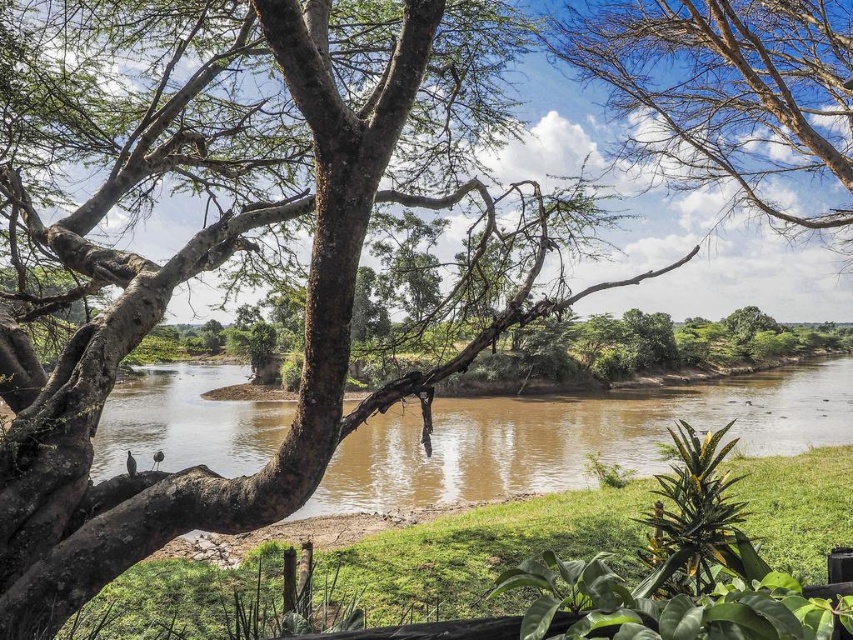
Question: Which point appears farthest from the camera in this image?

Choices:
 (A) (576, 403)
 (B) (614, 52)

Answer: (A)

Question: Which of the following is the farthest from the observer?

Choices:
 (A) (515, 458)
 (B) (666, 83)

Answer: (A)

Question: Can you confirm if brown muddy water at center is smaller than bare branches at upper center?

Choices:
 (A) no
 (B) yes

Answer: (A)

Question: Does brown muddy water at center have a smaller size compared to bare branches at upper center?

Choices:
 (A) yes
 (B) no

Answer: (B)

Question: Does brown muddy water at center have a greater width compared to bare branches at upper center?

Choices:
 (A) no
 (B) yes

Answer: (B)